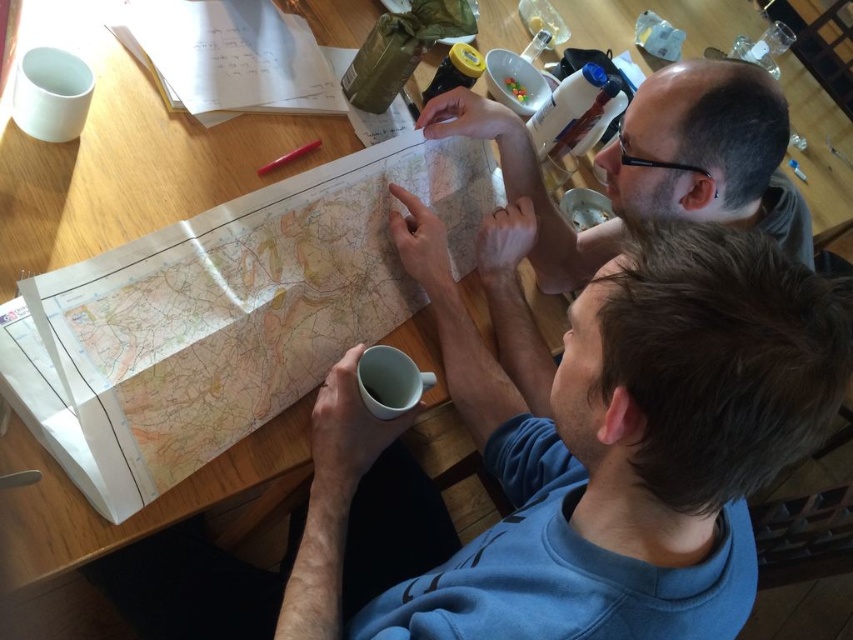
Question: Which of these objects is positioned farthest from the smooth skin at upper right?

Choices:
 (A) blue fleece at center
 (B) white matte mug at lower center
 (C) paper map at center

Answer: (B)

Question: Among these points, which one is farthest from the camera?

Choices:
 (A) (699, 166)
 (B) (311, 595)
 (C) (405, 305)
 (D) (419, 396)

Answer: (C)

Question: Does paper map at center have a greater width compared to smooth skin at upper right?

Choices:
 (A) yes
 (B) no

Answer: (B)

Question: Does blue fleece at center have a smaller size compared to white matte mug at lower center?

Choices:
 (A) no
 (B) yes

Answer: (A)

Question: Is paper map at center above smooth skin at upper right?

Choices:
 (A) no
 (B) yes

Answer: (A)

Question: Estimate the real-world distances between objects in this image. Which object is farther from the smooth skin at upper right?

Choices:
 (A) paper map at center
 (B) white matte mug at lower center

Answer: (B)